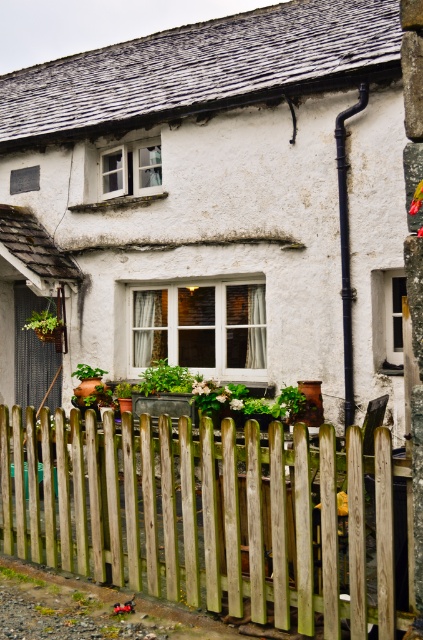
Measure the distance between point (277, 243) and camera.

Point (277, 243) and camera are 36.96 feet apart from each other.

Is white matte wooden fence at lower center thinner than weathered wood fence at lower center?

Incorrect, white matte wooden fence at lower center's width is not less than weathered wood fence at lower center's.

Which is behind, point (62, 211) or point (280, 604)?

Point (62, 211)

Locate an element on the screen. white matte wooden fence at lower center is located at coordinates (216, 198).